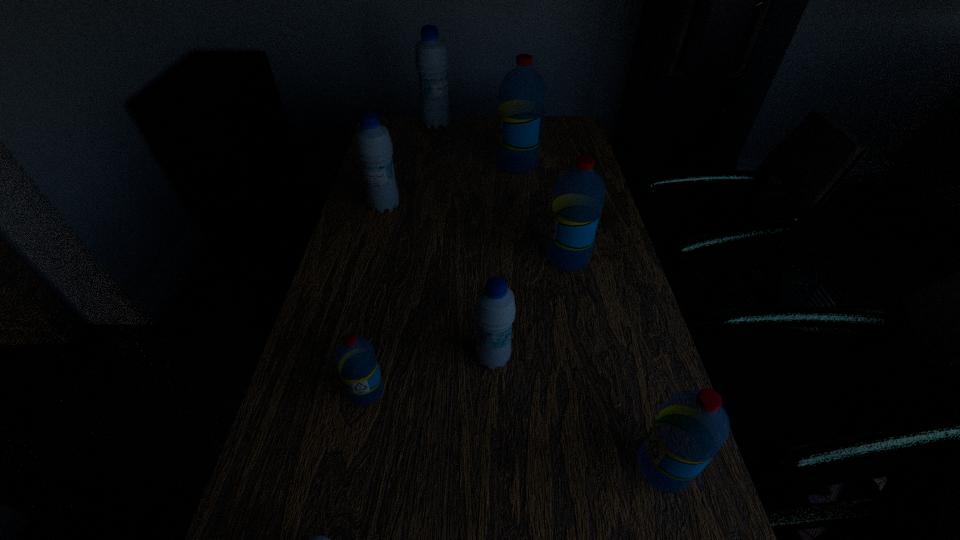
Where is `vacant region at the right edge`? vacant region at the right edge is located at coordinates (603, 313).

Image resolution: width=960 pixels, height=540 pixels. In order to click on vacant space at the far right corner of the desktop in this screenshot , I will do point(550,133).

At what (x,y) coordinates should I click in order to perform the action: click on vacant space that's between the third nearest water bottle and the farthest object. Please return your answer as a coordinate pair (x, y). The height and width of the screenshot is (540, 960). Looking at the image, I should click on (401, 258).

This screenshot has height=540, width=960. What are the coordinates of `vacant region between the farthest blue water bottle and the fifth nearest object` in the screenshot? It's located at (502, 191).

Locate an element on the screen. The width and height of the screenshot is (960, 540). free space between the farthest blue water bottle and the rightmost blue water bottle is located at coordinates (465, 241).

This screenshot has width=960, height=540. I want to click on vacant space that is in between the second nearest water bottle and the second nearest red water bottle, so click(x=516, y=429).

The width and height of the screenshot is (960, 540). I want to click on vacant area between the rightmost blue water bottle and the third smallest red water bottle, so click(531, 308).

The image size is (960, 540). In order to click on free space between the biggest blue water bottle and the third smallest red water bottle in this screenshot , I will do `click(502, 191)`.

Where is `free space between the farthest object and the second biggest blue water bottle`? This screenshot has height=540, width=960. free space between the farthest object and the second biggest blue water bottle is located at coordinates (411, 166).

The width and height of the screenshot is (960, 540). Identify the location of vacant space in between the leftmost red water bottle and the second biggest blue water bottle. (376, 299).